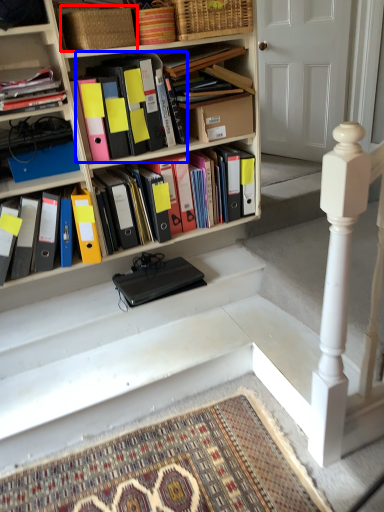
Question: Which object is closer to the camera taking this photo, basket (highlighted by a red box) or book (highlighted by a blue box)?

Choices:
 (A) basket
 (B) book

Answer: (A)